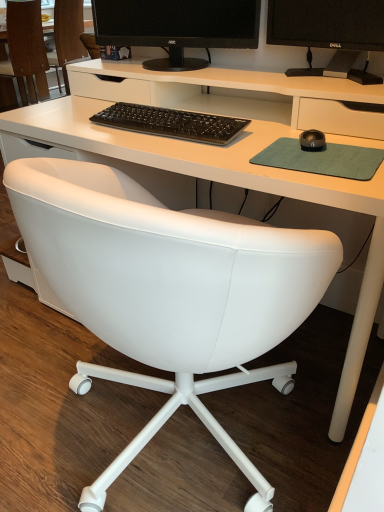
This screenshot has height=512, width=384. What are the coordinates of `white leather chair at center, placed as the 1th chair when sorted from right to left` in the screenshot? It's located at (168, 290).

At what (x,y) coordinates should I click in order to perform the action: click on green felt mousepad at right. Please return your answer as a coordinate pair (x, y). This screenshot has height=512, width=384. Looking at the image, I should click on (322, 159).

The width and height of the screenshot is (384, 512). What do you see at coordinates (329, 33) in the screenshot? I see `black glossy monitor at upper right` at bounding box center [329, 33].

Where is `white leather chair at lower left, the 2th chair positioned from the right`? The height and width of the screenshot is (512, 384). white leather chair at lower left, the 2th chair positioned from the right is located at coordinates (26, 50).

Image resolution: width=384 pixels, height=512 pixels. I want to click on white leather chair at center, which is the second chair from left to right, so click(x=168, y=290).

Is point (320, 143) more distant than point (372, 11)?

No.

From a real-world perspective, does black rubberized mouse at center-right sit lower than black glossy monitor at upper right?

Indeed, from a real-world perspective, black rubberized mouse at center-right is positioned beneath black glossy monitor at upper right.

From the image's perspective, which one is positioned lower, black rubberized mouse at center-right or black glossy monitor at upper right?

black rubberized mouse at center-right appears lower in the image.

Which of these two, black rubberized mouse at center-right or black glossy monitor at upper right, stands taller?

black glossy monitor at upper right is taller.

Is green felt mousepad at right completely or partially outside of black rubberized mouse at center-right?

Yes, green felt mousepad at right is located beyond the bounds of black rubberized mouse at center-right.

Does green felt mousepad at right have a larger size compared to black rubberized mouse at center-right?

Indeed, green felt mousepad at right has a larger size compared to black rubberized mouse at center-right.

Is green felt mousepad at right wider than black rubberized mouse at center-right?

Yes.

From the picture: Could you tell me if green felt mousepad at right is facing black rubberized mouse at center-right?

No, green felt mousepad at right does not turn towards black rubberized mouse at center-right.

In the scene shown: Is black matte keyboard at center aimed at white leather chair at lower left, positioned as the 1th chair in left-to-right order?

No, black matte keyboard at center is not facing towards white leather chair at lower left, positioned as the 1th chair in left-to-right order.

From their relative heights in the image, would you say black matte keyboard at center is taller or shorter than white leather chair at lower left, positioned as the 1th chair in left-to-right order?

Clearly, black matte keyboard at center is shorter compared to white leather chair at lower left, positioned as the 1th chair in left-to-right order.

Considering the relative sizes of black matte keyboard at center and white leather chair at lower left, the 2th chair positioned from the right, in the image provided, is black matte keyboard at center bigger than white leather chair at lower left, the 2th chair positioned from the right,?

Actually, black matte keyboard at center might be smaller than white leather chair at lower left, the 2th chair positioned from the right.

Is black matte keyboard at center placed right next to green felt mousepad at right?

No.

From the image's perspective, between black matte keyboard at center and green felt mousepad at right, which one is located above?

black matte keyboard at center appears higher in the image.

How distant is black matte keyboard at center from green felt mousepad at right?

They are 11.09 inches apart.

Could you tell me if black rubberized mouse at center-right is turned towards black matte monitor at upper center?

No, black rubberized mouse at center-right is not facing towards black matte monitor at upper center.

What's the angular difference between black rubberized mouse at center-right and black matte monitor at upper center's facing directions?

The angle between the facing direction of black rubberized mouse at center-right and the facing direction of black matte monitor at upper center is 6.07 degrees.

Is black rubberized mouse at center-right positioned behind black matte monitor at upper center?

No, the depth of black rubberized mouse at center-right is less than that of black matte monitor at upper center.

Is white leather chair at center, placed as the 1th chair when sorted from right to left, positioned far away from black rubberized mouse at center-right?

No, white leather chair at center, placed as the 1th chair when sorted from right to left, is in close proximity to black rubberized mouse at center-right.

Based on the photo, how different are the orientations of white leather chair at center, placed as the 1th chair when sorted from right to left, and black rubberized mouse at center-right in degrees?

67.7 degrees separate the facing orientations of white leather chair at center, placed as the 1th chair when sorted from right to left, and black rubberized mouse at center-right.

Is point (62, 267) positioned behind point (310, 136)?

No.

Is white leather chair at center, which is the second chair from left to right, not inside black rubberized mouse at center-right?

Indeed, white leather chair at center, which is the second chair from left to right, is completely outside black rubberized mouse at center-right.

Considering the positions of objects black rubberized mouse at center-right and white leather chair at lower left, positioned as the 1th chair in left-to-right order, in the image provided, who is in front, black rubberized mouse at center-right or white leather chair at lower left, positioned as the 1th chair in left-to-right order,?

black rubberized mouse at center-right is in front.

Between black rubberized mouse at center-right and white leather chair at lower left, the 2th chair positioned from the right, which one has larger width?

white leather chair at lower left, the 2th chair positioned from the right, is wider.

Is black rubberized mouse at center-right positioned with its back to white leather chair at lower left, the 2th chair positioned from the right?

black rubberized mouse at center-right does not have its back to white leather chair at lower left, the 2th chair positioned from the right.

Between black rubberized mouse at center-right and white leather chair at lower left, positioned as the 1th chair in left-to-right order, which one appears on the left side from the viewer's perspective?

white leather chair at lower left, positioned as the 1th chair in left-to-right order.

Where is `television located behind the black rubberized mouse at center-right`? The width and height of the screenshot is (384, 512). television located behind the black rubberized mouse at center-right is located at coordinates (329, 33).

Find the location of `mousepad lying below the black rubberized mouse at center-right (from the image's perspective)`. mousepad lying below the black rubberized mouse at center-right (from the image's perspective) is located at coordinates (322, 159).

Estimate the real-world distances between objects in this image. Which object is further from black matte keyboard at center, black glossy monitor at upper right or black matte monitor at upper center?

black glossy monitor at upper right is further to black matte keyboard at center.

Which object lies nearer to the anchor point white leather chair at center, which is the second chair from left to right, black rubberized mouse at center-right or white leather chair at lower left, positioned as the 1th chair in left-to-right order?

black rubberized mouse at center-right lies closer to white leather chair at center, which is the second chair from left to right, than the other object.

Which object lies nearer to the anchor point black matte keyboard at center, black matte monitor at upper center or green felt mousepad at right?

green felt mousepad at right.

From the image, which object appears to be nearer to white leather chair at lower left, positioned as the 1th chair in left-to-right order, black matte keyboard at center or black matte monitor at upper center?

black matte monitor at upper center lies closer to white leather chair at lower left, positioned as the 1th chair in left-to-right order, than the other object.

Estimate the real-world distances between objects in this image. Which object is further from black matte monitor at upper center, white leather chair at lower left, the 2th chair positioned from the right, or black matte keyboard at center?

white leather chair at lower left, the 2th chair positioned from the right, is further to black matte monitor at upper center.

Looking at the image, which one is located further to green felt mousepad at right, black glossy monitor at upper right or white leather chair at center, which is the second chair from left to right?

black glossy monitor at upper right lies further to green felt mousepad at right than the other object.

Considering their positions, is black matte monitor at upper center positioned further to black matte keyboard at center than black glossy monitor at upper right?

black glossy monitor at upper right is positioned further to the anchor black matte keyboard at center.

When comparing their distances from white leather chair at lower left, positioned as the 1th chair in left-to-right order, does green felt mousepad at right or black rubberized mouse at center-right seem further?

black rubberized mouse at center-right is further to white leather chair at lower left, positioned as the 1th chair in left-to-right order.

You are a GUI agent. You are given a task and a screenshot of the screen. Output one action in this format:
    pyautogui.click(x=<x>, y=<y>)
    Task: Click on the computer keyboard located between white leather chair at center, which is the second chair from left to right, and green felt mousepad at right in the left-right direction
    The width and height of the screenshot is (384, 512).
    Given the screenshot: What is the action you would take?
    pyautogui.click(x=171, y=123)

Find the location of a particular element. mousepad located between black matte keyboard at center and black rubberized mouse at center-right in the left-right direction is located at coordinates (322, 159).

Where is `television that lies between black matte monitor at upper center and green felt mousepad at right from top to bottom`? The height and width of the screenshot is (512, 384). television that lies between black matte monitor at upper center and green felt mousepad at right from top to bottom is located at coordinates (329, 33).

Find the location of a particular element. The height and width of the screenshot is (512, 384). computer keyboard that lies between black matte monitor at upper center and black rubberized mouse at center-right from top to bottom is located at coordinates (171, 123).